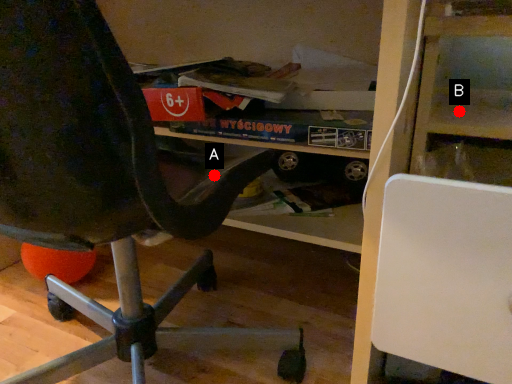
Question: Two points are circled on the image, labeled by A and B beside each circle. Which point appears farthest from the camera in this image?

Choices:
 (A) A is further
 (B) B is further

Answer: (B)